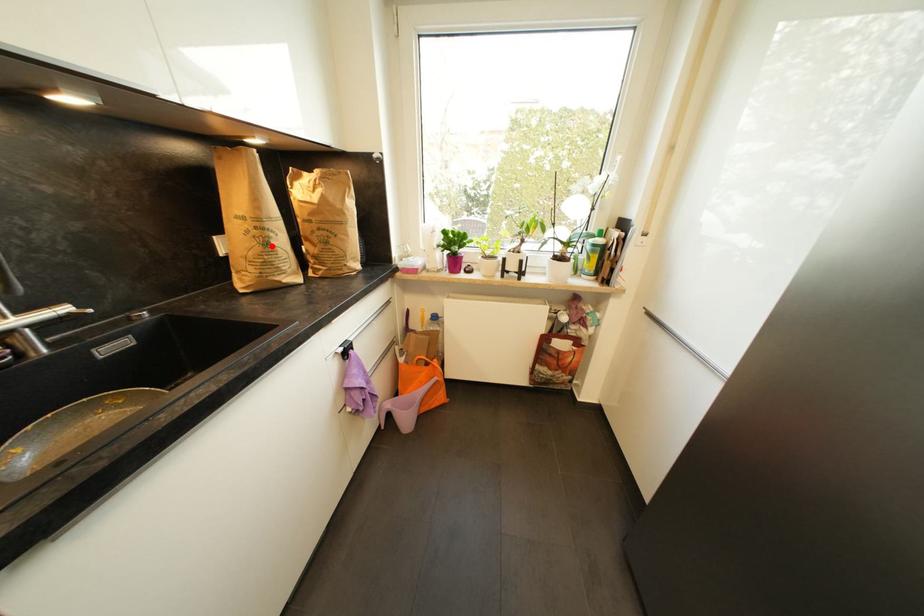
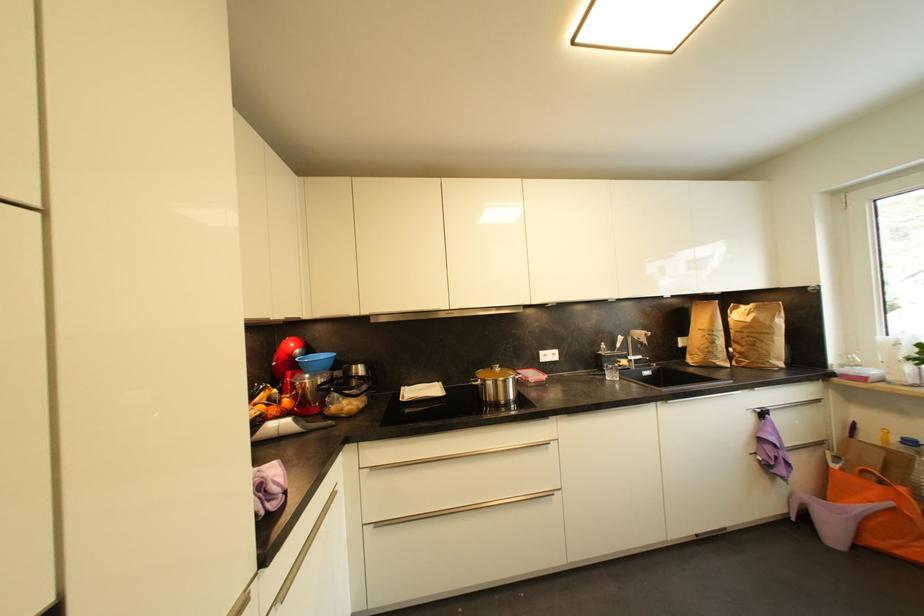
In the second image, find the point that corresponds to the highlighted location in the first image.

(718, 345)